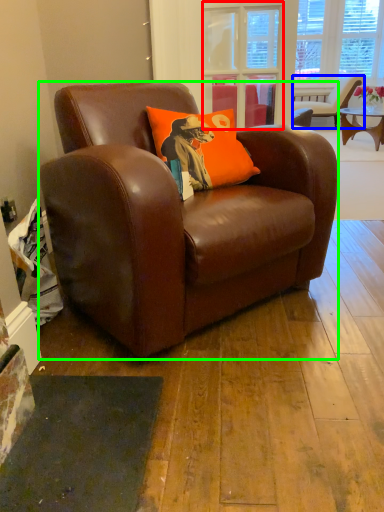
Question: Based on their relative distances, which object is farther from glass door (highlighted by a red box)? Choose from chair (highlighted by a blue box) and chair (highlighted by a green box).

Choices:
 (A) chair
 (B) chair

Answer: (A)